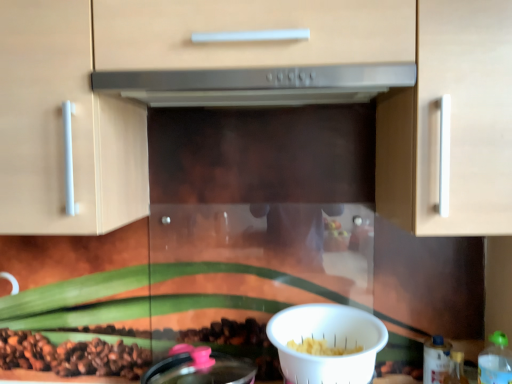
Question: Can you confirm if green plastic bottle at lower right, which is the third bottle in back-to-front order, is taller than white plastic bowl at lower center?

Choices:
 (A) no
 (B) yes

Answer: (B)

Question: Can you confirm if green plastic bottle at lower right, which is the third bottle in back-to-front order, is bigger than white plastic bowl at lower center?

Choices:
 (A) yes
 (B) no

Answer: (B)

Question: From the image's perspective, is green plastic bottle at lower right, which is counted as the 1th bottle, starting from the front, on top of white plastic bowl at lower center?

Choices:
 (A) yes
 (B) no

Answer: (B)

Question: Is green plastic bottle at lower right, which is the third bottle in back-to-front order, turned away from white plastic bowl at lower center?

Choices:
 (A) yes
 (B) no

Answer: (B)

Question: Is green plastic bottle at lower right, which is the third bottle in back-to-front order, facing towards white plastic bowl at lower center?

Choices:
 (A) yes
 (B) no

Answer: (B)

Question: Is translucent plastic bottle at lower right, which is counted as the second bottle, starting from the back, to the left or to the right of green plastic bottle at lower right, which is counted as the 1th bottle, starting from the front, in the image?

Choices:
 (A) left
 (B) right

Answer: (A)

Question: Would you say translucent plastic bottle at lower right, placed as the second bottle when sorted from front to back, is inside or outside green plastic bottle at lower right, which is the third bottle in back-to-front order?

Choices:
 (A) inside
 (B) outside

Answer: (B)

Question: From a real-world perspective, is translucent plastic bottle at lower right, placed as the second bottle when sorted from front to back, physically located above or below green plastic bottle at lower right, which is the third bottle in back-to-front order?

Choices:
 (A) above
 (B) below

Answer: (B)

Question: In the image, is translucent plastic bottle at lower right, placed as the second bottle when sorted from front to back, positioned in front of or behind green plastic bottle at lower right, which is counted as the 1th bottle, starting from the front?

Choices:
 (A) front
 (B) behind

Answer: (B)

Question: In terms of height, does green plastic bottle at lower right, which is counted as the 1th bottle, starting from the front, look taller or shorter compared to translucent plastic bottle at lower right, which is counted as the second bottle, starting from the back?

Choices:
 (A) short
 (B) tall

Answer: (B)

Question: Is green plastic bottle at lower right, which is counted as the 1th bottle, starting from the front, spatially inside translucent plastic bottle at lower right, which is counted as the second bottle, starting from the back, or outside of it?

Choices:
 (A) outside
 (B) inside

Answer: (A)

Question: Is point (489, 379) closer or farther from the camera than point (451, 352)?

Choices:
 (A) farther
 (B) closer

Answer: (B)

Question: From a real-world perspective, is green plastic bottle at lower right, which is the third bottle in back-to-front order, above or below translucent plastic bottle at lower right, placed as the second bottle when sorted from front to back?

Choices:
 (A) below
 (B) above

Answer: (B)

Question: Visually, is white plastic bowl at lower center positioned to the left or to the right of translucent plastic bottle at lower right, which is counted as the second bottle, starting from the back?

Choices:
 (A) right
 (B) left

Answer: (B)

Question: Based on their sizes in the image, would you say white plastic bowl at lower center is bigger or smaller than translucent plastic bottle at lower right, which is counted as the second bottle, starting from the back?

Choices:
 (A) big
 (B) small

Answer: (A)